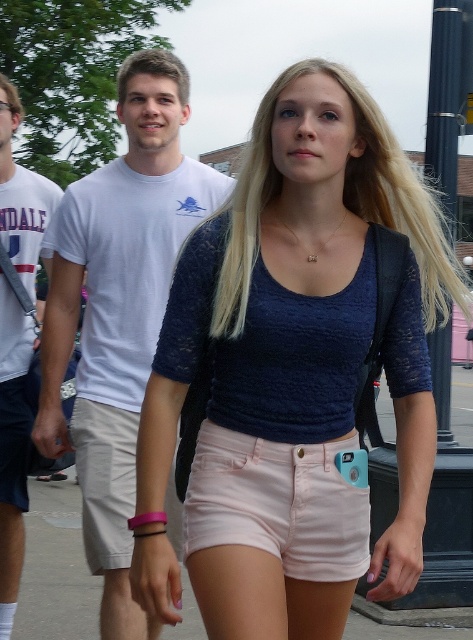
Question: Where is white cotton t-shirt at center located in relation to pink fabric shorts at center in the image?

Choices:
 (A) left
 (B) right

Answer: (A)

Question: Which object is farther from the camera taking this photo?

Choices:
 (A) white cotton t-shirt at upper left
 (B) blue lace top at center

Answer: (A)

Question: Does light pink cotton shorts at center come behind pink fabric shorts at center?

Choices:
 (A) no
 (B) yes

Answer: (A)

Question: Estimate the real-world distances between objects in this image. Which object is closer to the white cotton t-shirt at upper left?

Choices:
 (A) blue lace top at center
 (B) light pink cotton shorts at center
 (C) matte white t-shirt at upper center

Answer: (C)

Question: Can you confirm if matte white t-shirt at upper center is wider than pink fabric shorts at center?

Choices:
 (A) yes
 (B) no

Answer: (B)

Question: Estimate the real-world distances between objects in this image. Which object is closer to the blue lace top at center?

Choices:
 (A) matte white t-shirt at upper center
 (B) white cotton t-shirt at center

Answer: (A)